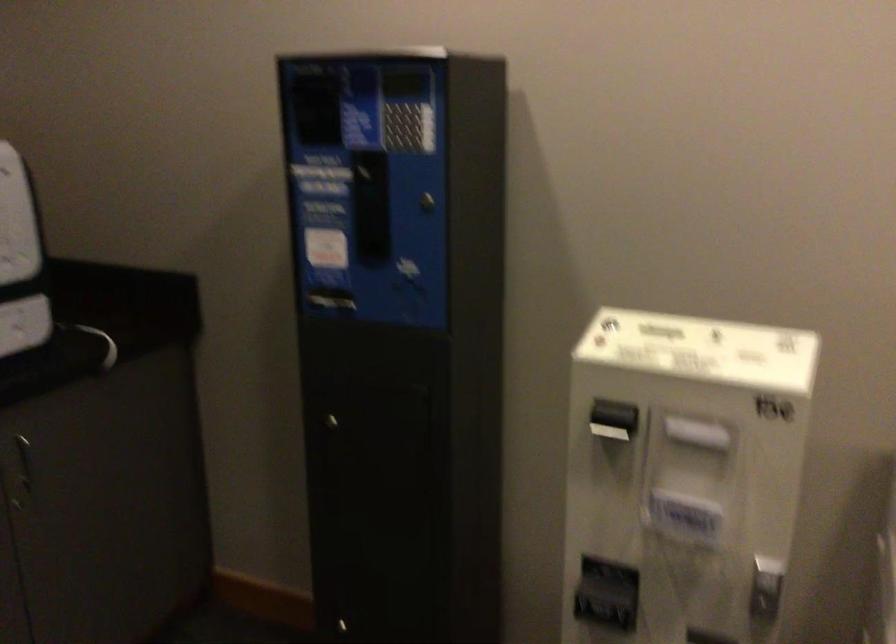
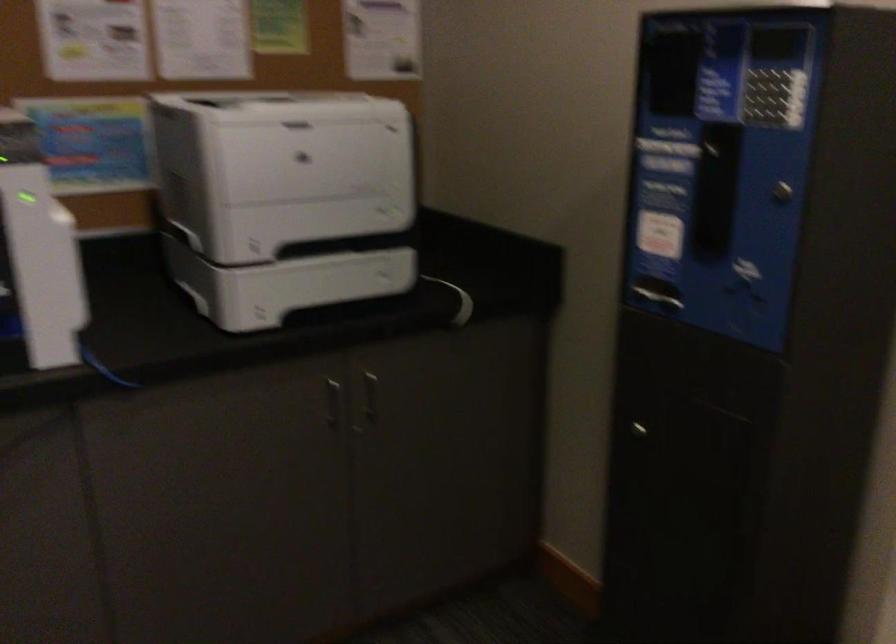
Question: The first image is from the beginning of the video and the second image is from the end. How did the camera likely rotate when shooting the video?

Choices:
 (A) Left
 (B) Right
 (C) Up
 (D) Down

Answer: (A)